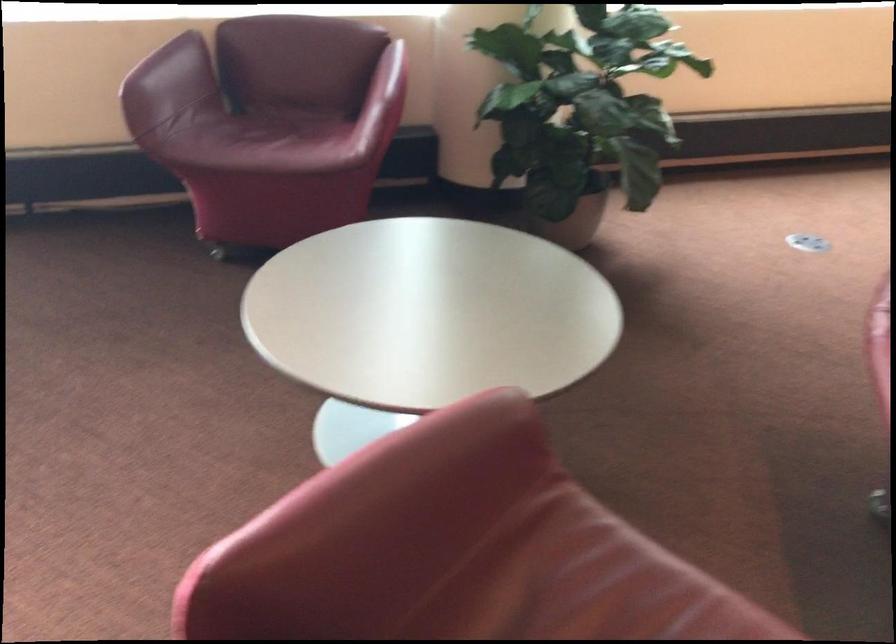
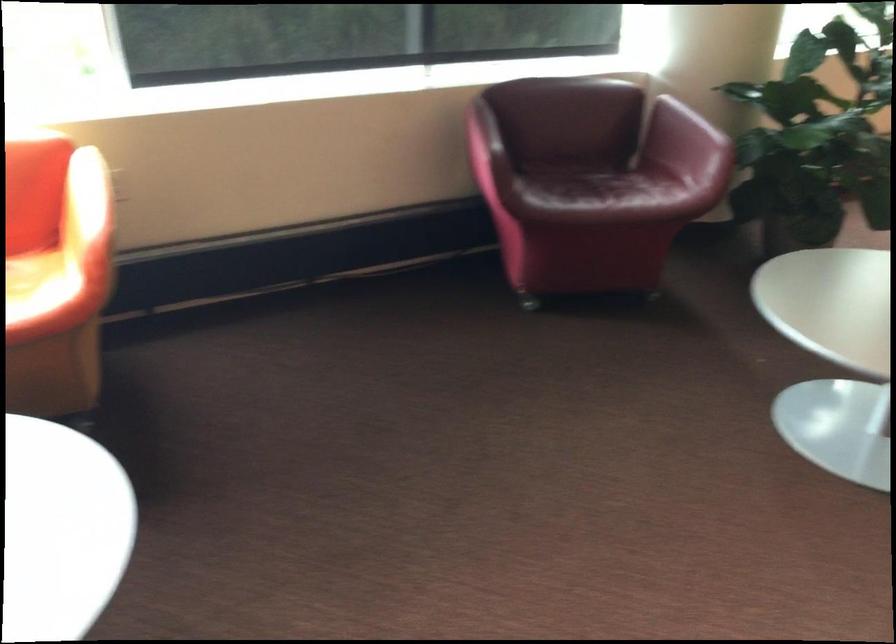
The point at (280, 145) is marked in the first image. Where is the corresponding point in the second image?

(608, 194)